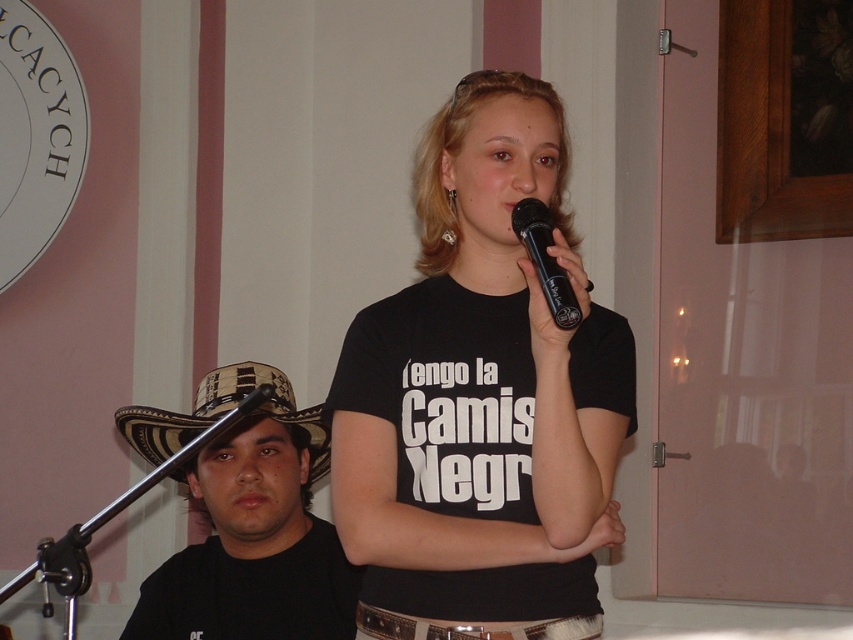
You are at a social event and want to take a photo of both the woman speaking into the microphone and the man seated behind her. To ensure both are in focus, you need to know which of the two points, point (427, 225) or point (256, 381), is closer to the camera. Can you determine this?

Point (427, 225) is closer to the camera than point (256, 381), so focus on that point first to ensure both subjects are in focus.

You are at a social event and need to locate two specific points marked on the floor. The first point is at coordinates point (386, 541) and the second is at point (183, 556). Which point is closer to the speaker holding the microphone?

Point (386, 541) is in front of point (183, 556), so it is closer to the speaker holding the microphone.

You are at a party and need to adjust the volume of the microphone. The black plastic microphone at upper center is currently behind the black matte shirt at center. Can you easily access the microphone to adjust its settings?

The black plastic microphone at upper center is behind the black matte shirt at center, making it difficult to access for adjusting the volume.